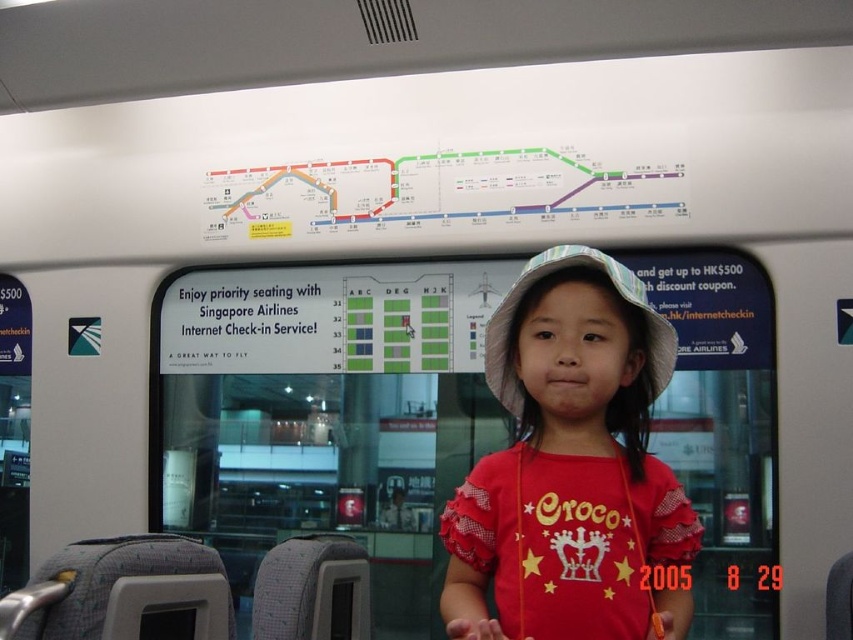
Question: Is red cotton shirt at center above light blue fabric hat at center?

Choices:
 (A) yes
 (B) no

Answer: (B)

Question: Does red cotton shirt at center come in front of light blue fabric hat at center?

Choices:
 (A) yes
 (B) no

Answer: (A)

Question: Which point appears farthest from the camera in this image?

Choices:
 (A) (651, 362)
 (B) (677, 538)

Answer: (A)

Question: Can you confirm if red cotton shirt at center is thinner than light blue fabric hat at center?

Choices:
 (A) yes
 (B) no

Answer: (B)